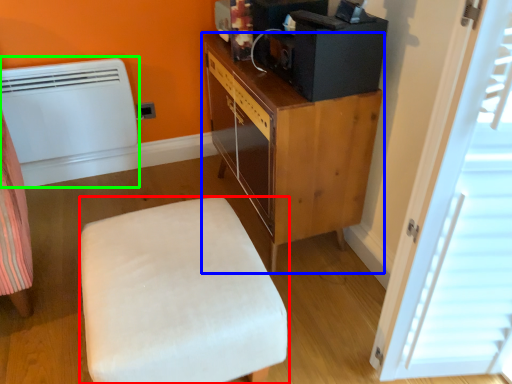
Question: Which object is the closest to the furniture (highlighted by a red box)? Choose among these: cabinetry (highlighted by a blue box) or heater (highlighted by a green box).

Choices:
 (A) cabinetry
 (B) heater

Answer: (A)